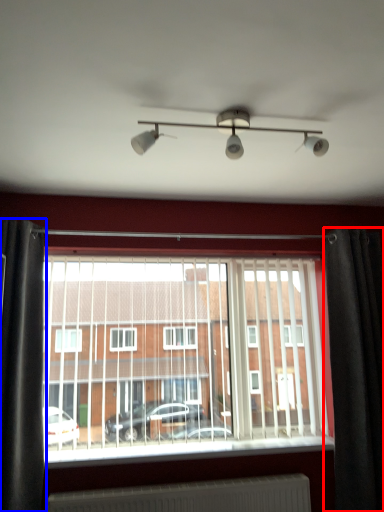
Question: Which point is closer to the camera, curtain (highlighted by a red box) or curtain (highlighted by a blue box)?

Choices:
 (A) curtain
 (B) curtain

Answer: (B)